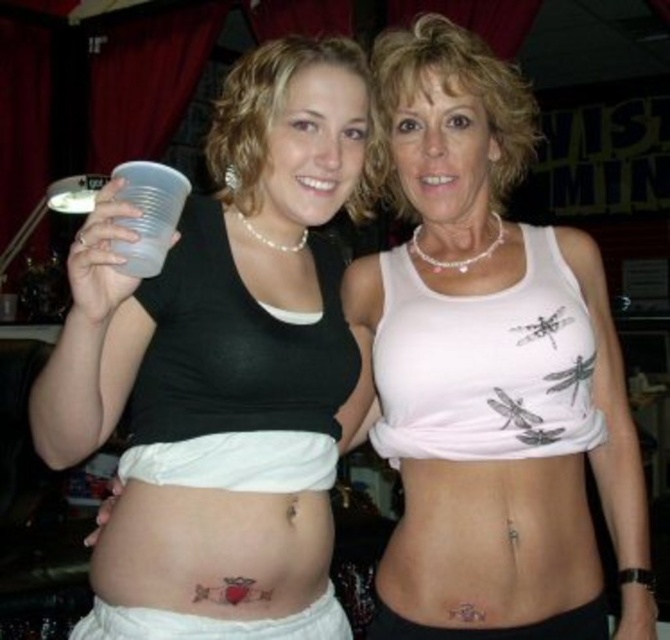
Question: Estimate the real-world distances between objects in this image. Which object is closer to the black matte tank top at center?

Choices:
 (A) white matte tank top at center
 (B) white fabric at lower center
 (C) white matte bikini top at center

Answer: (C)

Question: Which point is closer to the camera?

Choices:
 (A) black matte tank top at center
 (B) white fabric at lower center
 (C) white matte bikini top at center

Answer: (A)

Question: Does white matte tank top at center have a greater width compared to white matte bikini top at center?

Choices:
 (A) yes
 (B) no

Answer: (A)

Question: Is the position of white matte bikini top at center more distant than that of white fabric at lower center?

Choices:
 (A) no
 (B) yes

Answer: (B)

Question: Is white matte bikini top at center behind white fabric at lower center?

Choices:
 (A) yes
 (B) no

Answer: (A)

Question: Estimate the real-world distances between objects in this image. Which object is closer to the black matte tank top at center?

Choices:
 (A) white fabric at lower center
 (B) white matte bikini top at center
 (C) white matte tank top at center

Answer: (B)